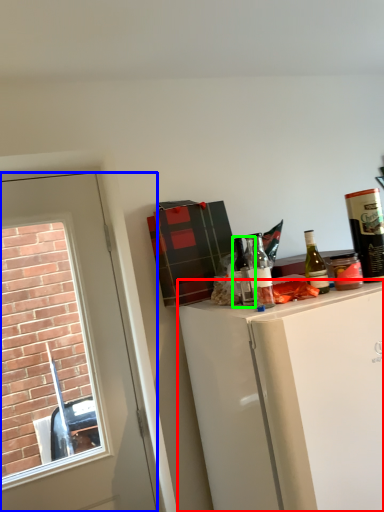
Question: Which object is positioned closest to cabinetry (highlighted by a red box)? Select from door (highlighted by a blue box) and bottle (highlighted by a green box).

Choices:
 (A) door
 (B) bottle

Answer: (B)